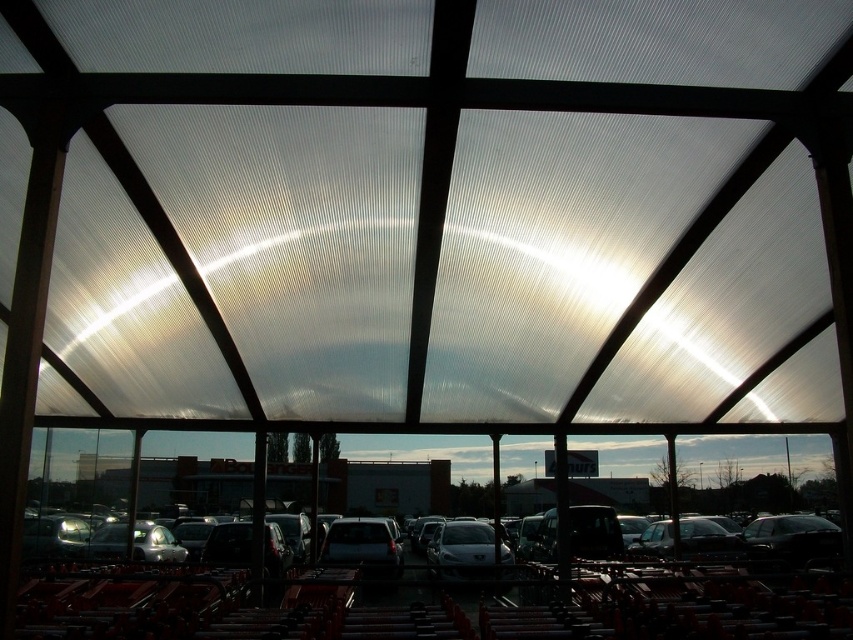
Between metallic gray cars at center and matte black suv at center, which one is positioned lower?

Positioned lower is matte black suv at center.

Is metallic gray cars at center shorter than matte black suv at center?

No, metallic gray cars at center is not shorter than matte black suv at center.

Who is more forward, (x=190, y=580) or (x=372, y=528)?

Point (x=190, y=580) is in front.

In order to click on metallic gray cars at center in this screenshot , I will do `click(213, 605)`.